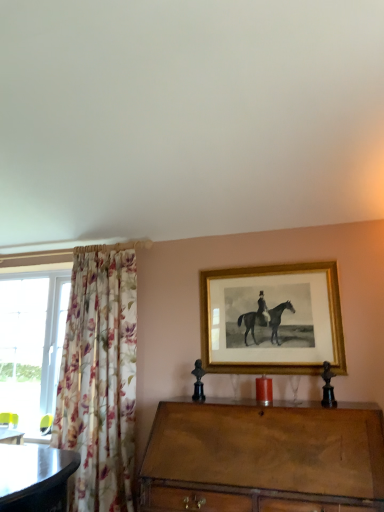
Question: Do you think floral fabric curtain at left is within brown wooden desk at lower left, or outside of it?

Choices:
 (A) inside
 (B) outside

Answer: (B)

Question: Visually, is floral fabric curtain at left positioned to the left or to the right of brown wooden desk at lower left?

Choices:
 (A) left
 (B) right

Answer: (B)

Question: Estimate the real-world distances between objects in this image. Which object is farther from the floral fabric curtain at left?

Choices:
 (A) wooden chest of drawers at center
 (B) gold/gilded picture frame at upper center
 (C) brown wooden desk at lower left

Answer: (A)

Question: Which of these objects is positioned closest to the brown wooden desk at lower left?

Choices:
 (A) gold/gilded picture frame at upper center
 (B) floral fabric curtain at left
 (C) wooden chest of drawers at center

Answer: (B)